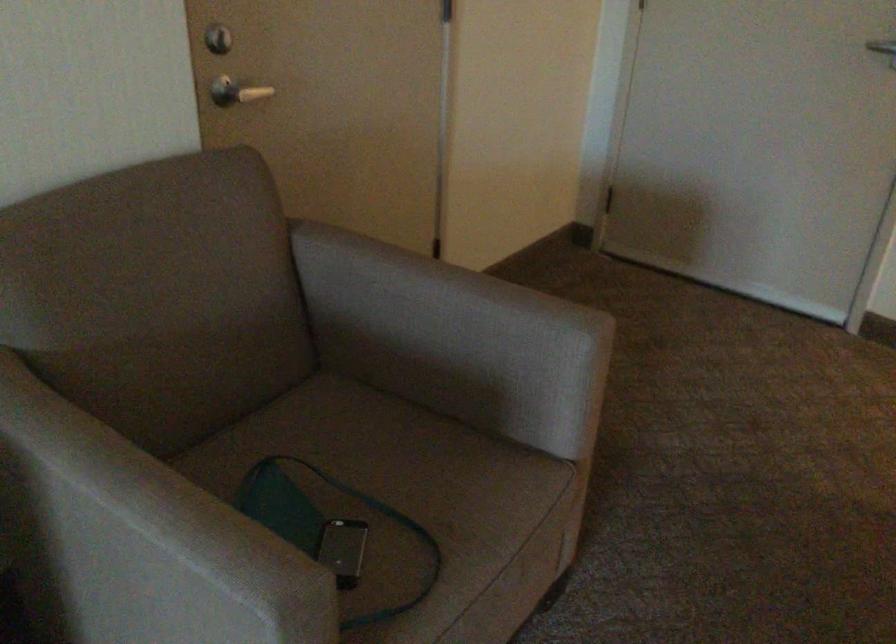
What do you see at coordinates (342, 550) in the screenshot?
I see `a silver mobile phone` at bounding box center [342, 550].